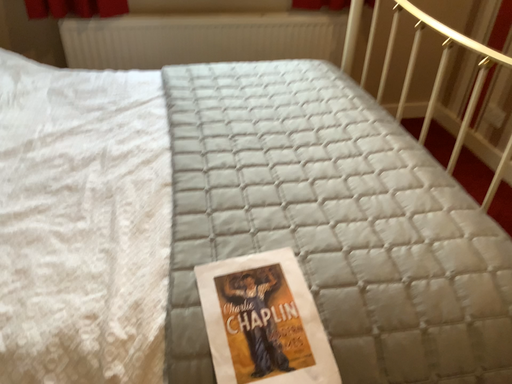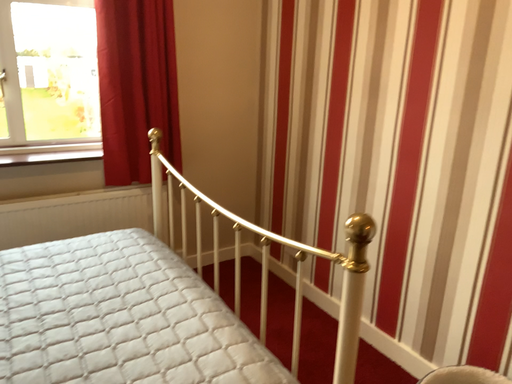
Question: Which way did the camera rotate in the video?

Choices:
 (A) rotated upward
 (B) rotated downward

Answer: (A)